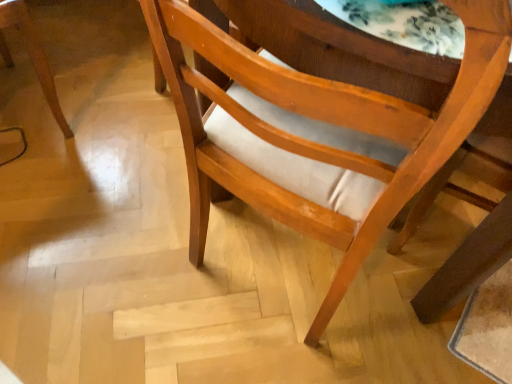
Locate an element on the screen. vacant region to the left of wooden chair at center is located at coordinates (132, 239).